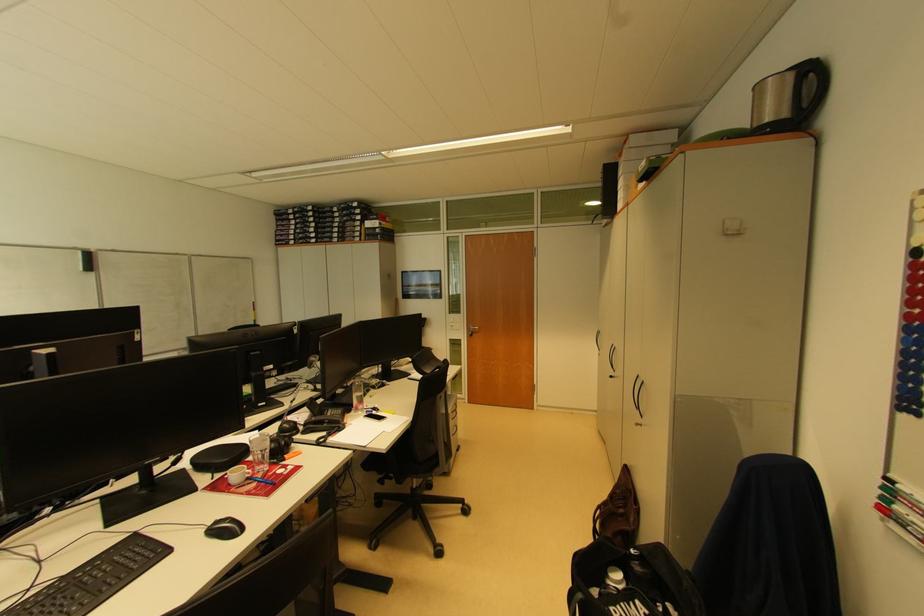
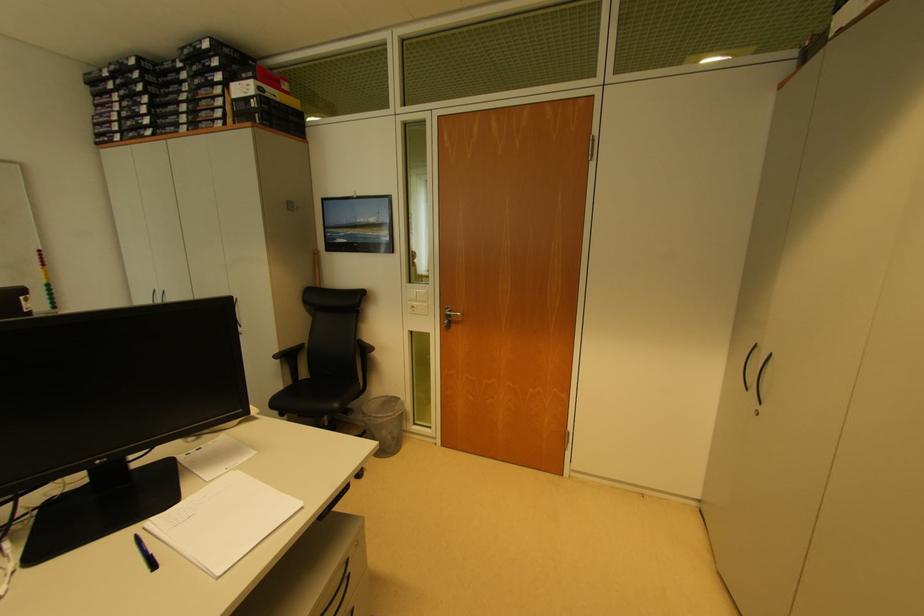
Question: In a continuous first-person perspective shot, in which direction is the camera moving?

Choices:
 (A) Left
 (B) Right
 (C) Forward
 (D) Backward

Answer: (C)